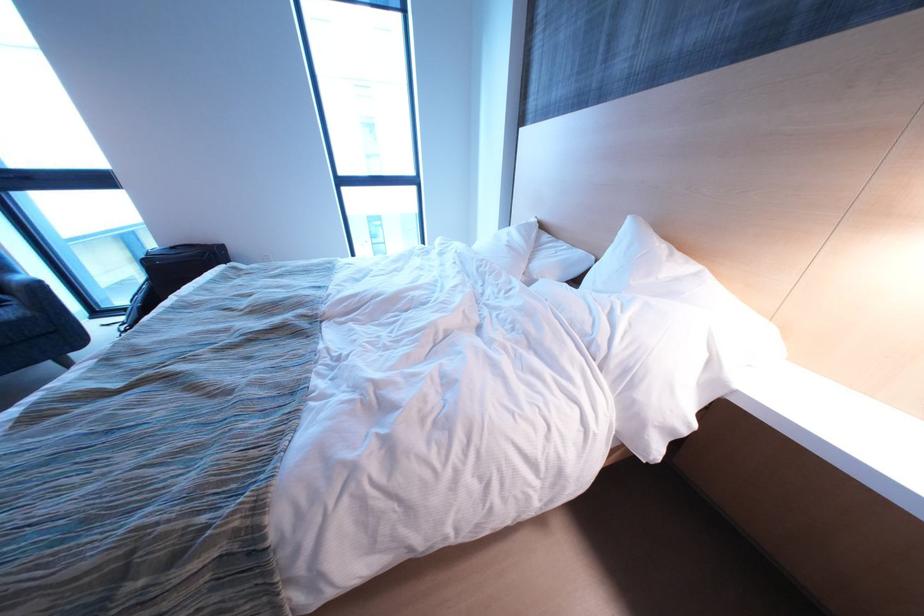
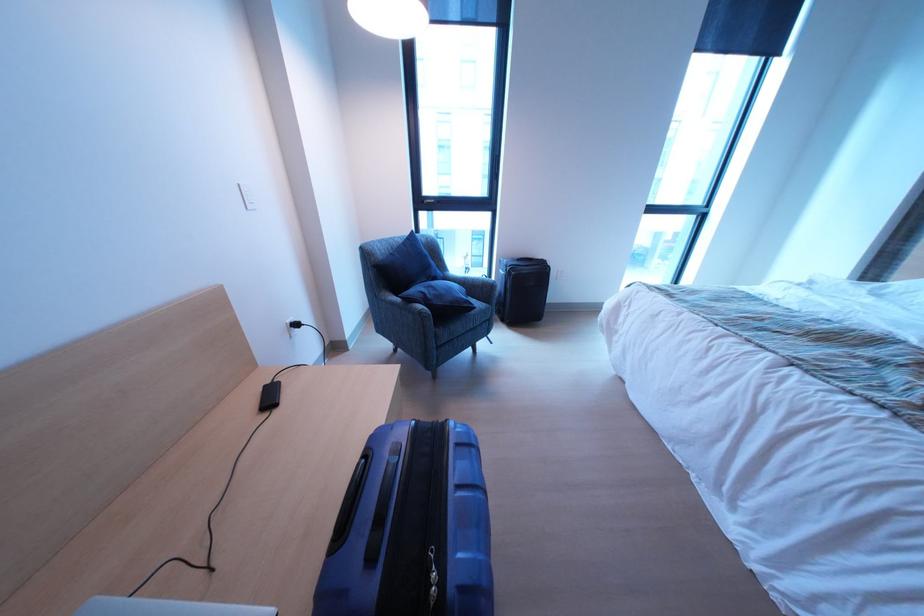
Question: Which direction would the cameraman need to move to produce the second image? Reply with the corresponding letter.

Choices:
 (A) Left
 (B) Right
 (C) Forward
 (D) Backward

Answer: (A)